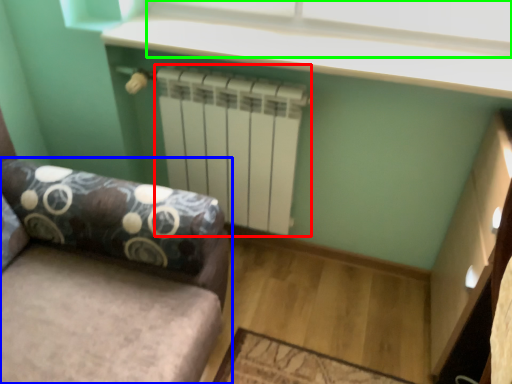
Question: Based on their relative distances, which object is farther from radiator (highlighted by a red box)? Choose from studio couch (highlighted by a blue box) and window screen (highlighted by a green box).

Choices:
 (A) studio couch
 (B) window screen

Answer: (A)